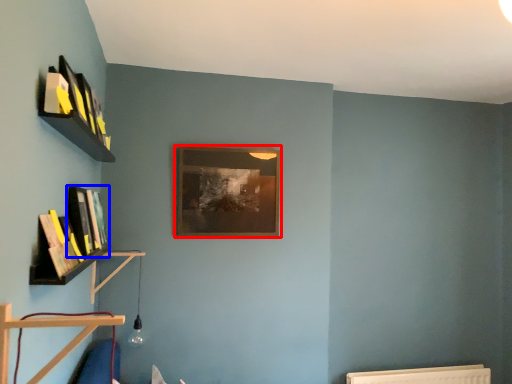
Question: Which object is further to the camera taking this photo, picture frame (highlighted by a red box) or book (highlighted by a blue box)?

Choices:
 (A) picture frame
 (B) book

Answer: (A)